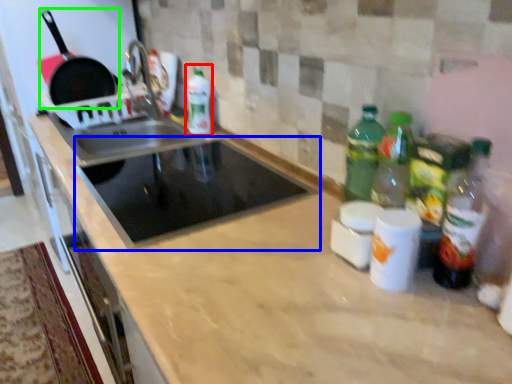
Question: Considering the real-world distances, which object is closest to bottle (highlighted by a red box)? appliance (highlighted by a blue box) or frying pan (highlighted by a green box).

Choices:
 (A) appliance
 (B) frying pan

Answer: (A)